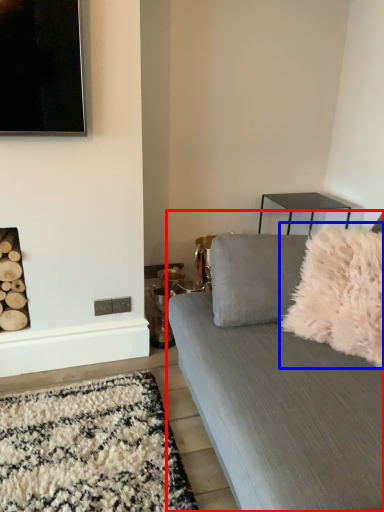
Question: Which object appears farthest to the camera in this image, studio couch (highlighted by a red box) or throw pillow (highlighted by a blue box)?

Choices:
 (A) studio couch
 (B) throw pillow

Answer: (B)